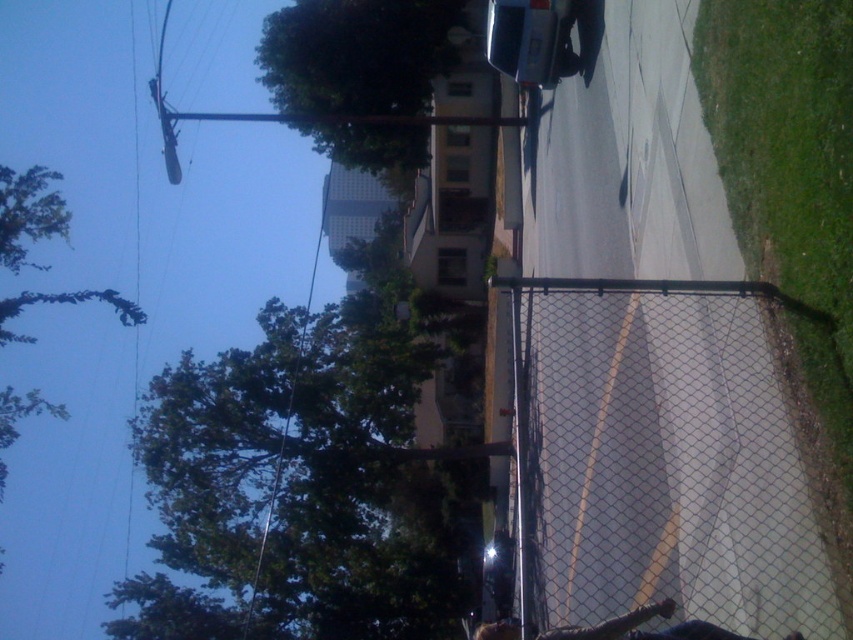
Question: Does green leafy tree at center have a lesser width compared to green leafy tree at upper left?

Choices:
 (A) no
 (B) yes

Answer: (B)

Question: Which of the following is the closest to the observer?

Choices:
 (A) green leafy tree at upper left
 (B) metallic wire at upper center
 (C) black chain-link fence at right
 (D) metallic wire at upper left

Answer: (C)

Question: Considering the real-world distances, which object is closest to the black chain-link fence at right?

Choices:
 (A) metallic wire at upper center
 (B) green leafy tree at center
 (C) green leafy tree at upper left

Answer: (C)

Question: Does black chain-link fence at right have a lesser width compared to green leafy tree at upper left?

Choices:
 (A) yes
 (B) no

Answer: (A)

Question: Which object is closer to the camera taking this photo?

Choices:
 (A) metallic wire at upper left
 (B) black chain-link fence at right

Answer: (B)

Question: Is green leafy tree at center to the right of green leafy tree at upper center from the viewer's perspective?

Choices:
 (A) no
 (B) yes

Answer: (A)